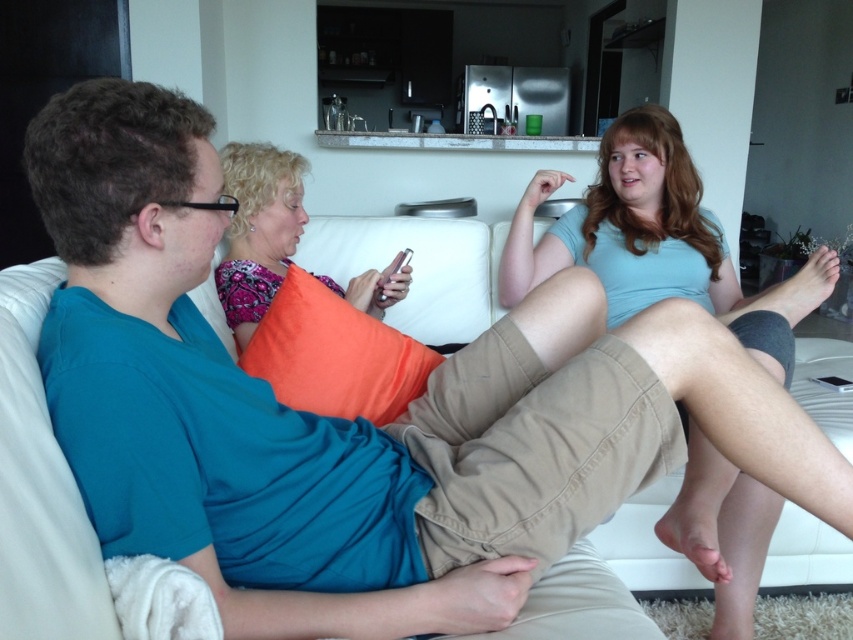
Question: Can you confirm if matte blue shirt at upper right is positioned to the left of patterned fabric pillow at center?

Choices:
 (A) no
 (B) yes

Answer: (A)

Question: Is matte blue shirt at upper right below patterned fabric pillow at center?

Choices:
 (A) yes
 (B) no

Answer: (A)

Question: Which of the following is the farthest from the observer?

Choices:
 (A) (648, 113)
 (B) (260, 144)

Answer: (A)

Question: Which point is closer to the camera?

Choices:
 (A) patterned fabric pillow at center
 (B) matte blue shirt at upper right

Answer: (B)

Question: Can you confirm if matte blue shirt at upper right is positioned above patterned fabric pillow at center?

Choices:
 (A) yes
 (B) no

Answer: (B)